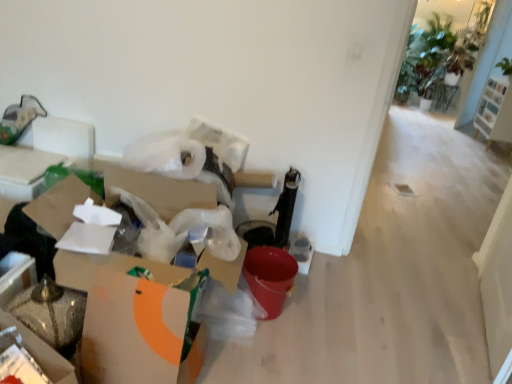
Question: Is white cardboard box at lower left, positioned as the first cardboard box in front-to-back order, positioned far away from white wood shoe rack at upper right?

Choices:
 (A) yes
 (B) no

Answer: (A)

Question: Is white cardboard box at lower left, the 2th cardboard box positioned from the back, to the left of white wood shoe rack at upper right from the viewer's perspective?

Choices:
 (A) no
 (B) yes

Answer: (B)

Question: Could you tell me if white cardboard box at lower left, the 2th cardboard box positioned from the back, is turned towards white wood shoe rack at upper right?

Choices:
 (A) no
 (B) yes

Answer: (A)

Question: Is white cardboard box at lower left, positioned as the first cardboard box in front-to-back order, to the right of white wood shoe rack at upper right from the viewer's perspective?

Choices:
 (A) yes
 (B) no

Answer: (B)

Question: Is white cardboard box at lower left, the 2th cardboard box positioned from the back, not inside white wood shoe rack at upper right?

Choices:
 (A) no
 (B) yes

Answer: (B)

Question: In terms of width, does white wood shoe rack at upper right look wider or thinner when compared to white cardboard box at left, which ranks as the second cardboard box in front-to-back order?

Choices:
 (A) wide
 (B) thin

Answer: (B)

Question: From a real-world perspective, is white wood shoe rack at upper right physically located above or below white cardboard box at left, which ranks as the second cardboard box in front-to-back order?

Choices:
 (A) below
 (B) above

Answer: (B)

Question: Considering their positions, is white wood shoe rack at upper right located in front of or behind white cardboard box at left, which ranks as the second cardboard box in front-to-back order?

Choices:
 (A) behind
 (B) front

Answer: (A)

Question: From the image's perspective, is white wood shoe rack at upper right located above or below white cardboard box at left, which ranks as the second cardboard box in front-to-back order?

Choices:
 (A) below
 (B) above

Answer: (B)

Question: In terms of height, does white wood shoe rack at upper right look taller or shorter compared to white cardboard box at lower left, positioned as the first cardboard box in front-to-back order?

Choices:
 (A) short
 (B) tall

Answer: (B)

Question: Do you think white wood shoe rack at upper right is within white cardboard box at lower left, positioned as the first cardboard box in front-to-back order, or outside of it?

Choices:
 (A) outside
 (B) inside

Answer: (A)

Question: Looking at their shapes, would you say white wood shoe rack at upper right is wider or thinner than white cardboard box at lower left, positioned as the first cardboard box in front-to-back order?

Choices:
 (A) thin
 (B) wide

Answer: (A)

Question: Is point (503, 119) positioned closer to the camera than point (160, 264)?

Choices:
 (A) farther
 (B) closer

Answer: (A)

Question: Considering the positions of white cardboard box at lower left, positioned as the first cardboard box in front-to-back order, and white wood shoe rack at upper right in the image, is white cardboard box at lower left, positioned as the first cardboard box in front-to-back order, wider or thinner than white wood shoe rack at upper right?

Choices:
 (A) thin
 (B) wide

Answer: (B)

Question: Based on their sizes in the image, would you say white cardboard box at lower left, positioned as the first cardboard box in front-to-back order, is bigger or smaller than white wood shoe rack at upper right?

Choices:
 (A) big
 (B) small

Answer: (B)